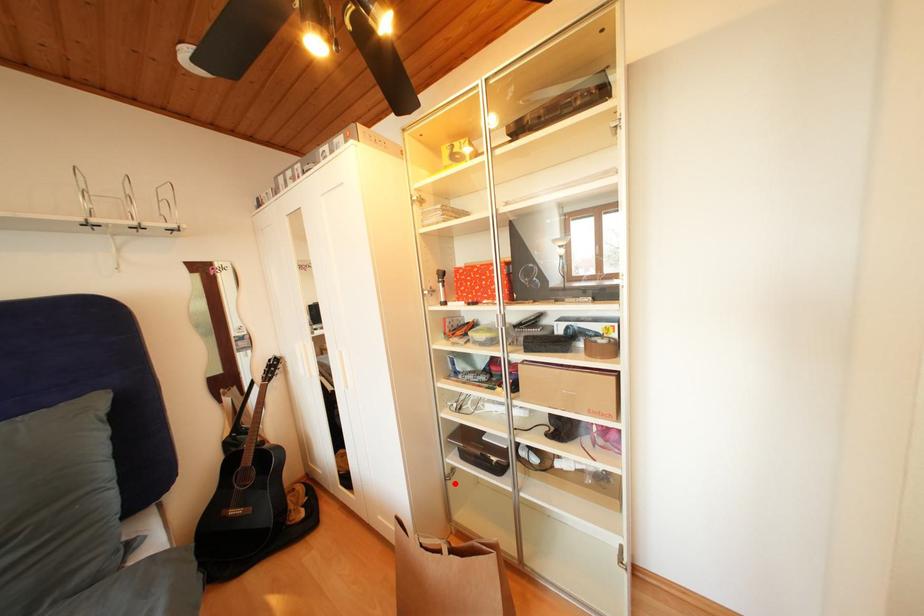
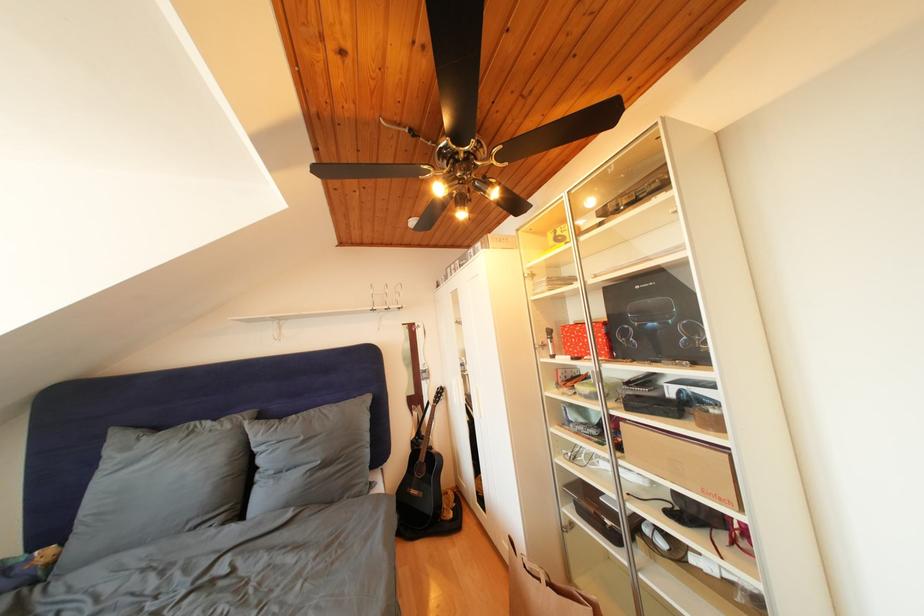
Question: A red point is marked in image1. In image2, is the corresponding 3D point closer to the camera or farther? Reply with the corresponding letter.

Choices:
 (A) The corresponding 3D point is closer.
 (B) The corresponding 3D point is farther.

Answer: (A)